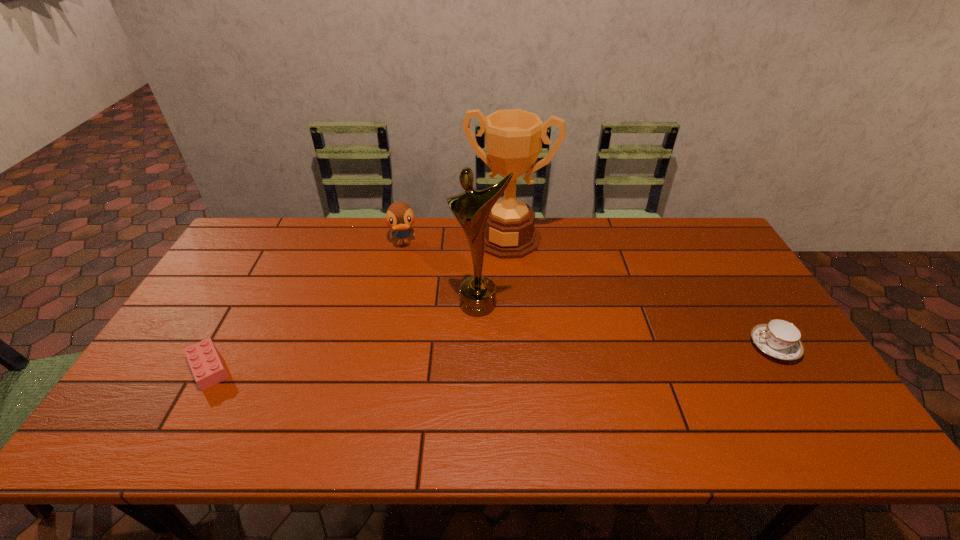
The height and width of the screenshot is (540, 960). In order to click on vacant area that lies between the fourth object from right to left and the third farthest object in this screenshot , I will do [441, 274].

I want to click on vacant area between the third tallest object and the farther award, so click(x=455, y=241).

The height and width of the screenshot is (540, 960). In order to click on the closest object to the farther award in this screenshot , I will do `click(471, 208)`.

Locate which object ranks fourth in proximity to the farther award. Please provide its 2D coordinates. Your answer should be formatted as a tuple, i.e. [(x, y)], where the tuple contains the x and y coordinates of a point satisfying the conditions above.

[(206, 365)]

At what (x,y) coordinates should I click in order to perform the action: click on vacant point that satisfies the following two spatial constraints: 1. on the back side of the leftmost object; 2. on the left side of the nearer award. Please return your answer as a coordinate pair (x, y). Image resolution: width=960 pixels, height=540 pixels. Looking at the image, I should click on (245, 304).

At what (x,y) coordinates should I click in order to perform the action: click on free space that satisfies the following two spatial constraints: 1. on the back side of the Lego; 2. on the left side of the third shortest object. Please return your answer as a coordinate pair (x, y). This screenshot has width=960, height=540. Looking at the image, I should click on (278, 244).

Image resolution: width=960 pixels, height=540 pixels. What are the coordinates of `blank space that satisfies the following two spatial constraints: 1. on the front side of the third nearest object; 2. on the left side of the duck` in the screenshot? It's located at (391, 304).